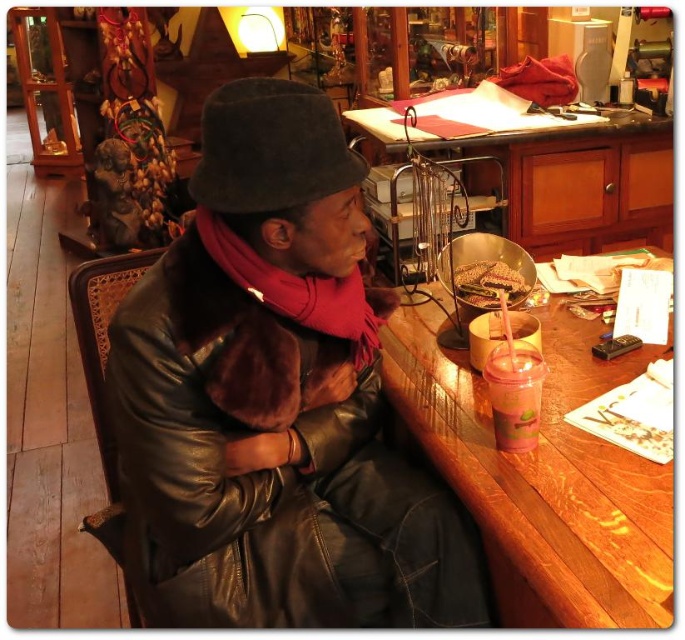
Which is more to the right, felt hat at upper left or fuzzy red scarf at center?

Positioned to the right is fuzzy red scarf at center.

Which is above, felt hat at upper left or fuzzy red scarf at center?

felt hat at upper left is higher up.

I want to click on felt hat at upper left, so click(271, 148).

Does wooden table at right have a greater height compared to wooden table at upper center?

No.

Which is behind, point (460, 435) or point (660, 204)?

The point (660, 204) is more distant.

Find the location of a particular element. wooden table at right is located at coordinates (543, 476).

Which is behind, point (558, 378) or point (312, 120)?

The point (558, 378) is behind.

Is point (506, 497) in front of point (336, 163)?

That is True.

Who is more distant from viewer, (638,480) or (310,90)?

The point (638,480) is behind.

Where is `wooden table at right`? Image resolution: width=685 pixels, height=640 pixels. wooden table at right is located at coordinates [x=543, y=476].